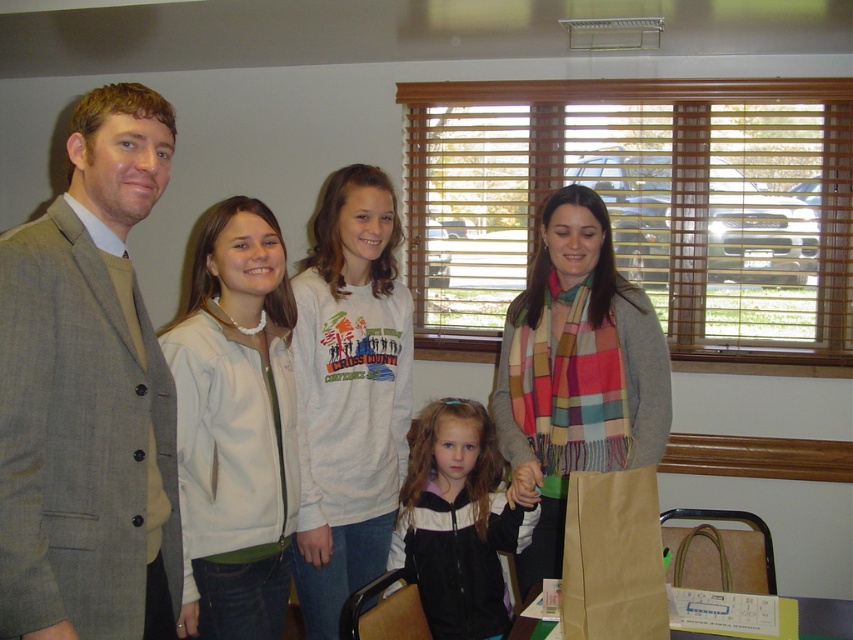
You are a photographer setting up for a group photo. You have two jackets, the white fleece jacket at center and the black matte jacket at center, placed side by side on a rack. Which jacket takes up less horizontal space?

The white fleece jacket at center has a lesser width compared to the black matte jacket at center, so it takes up less horizontal space.